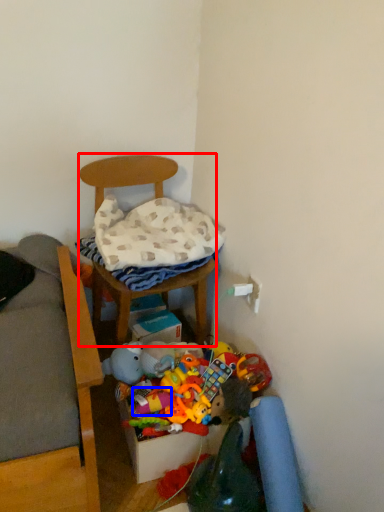
Question: Which of the following is the closest to the observer, furniture (highlighted by a red box) or toy (highlighted by a blue box)?

Choices:
 (A) furniture
 (B) toy

Answer: (A)